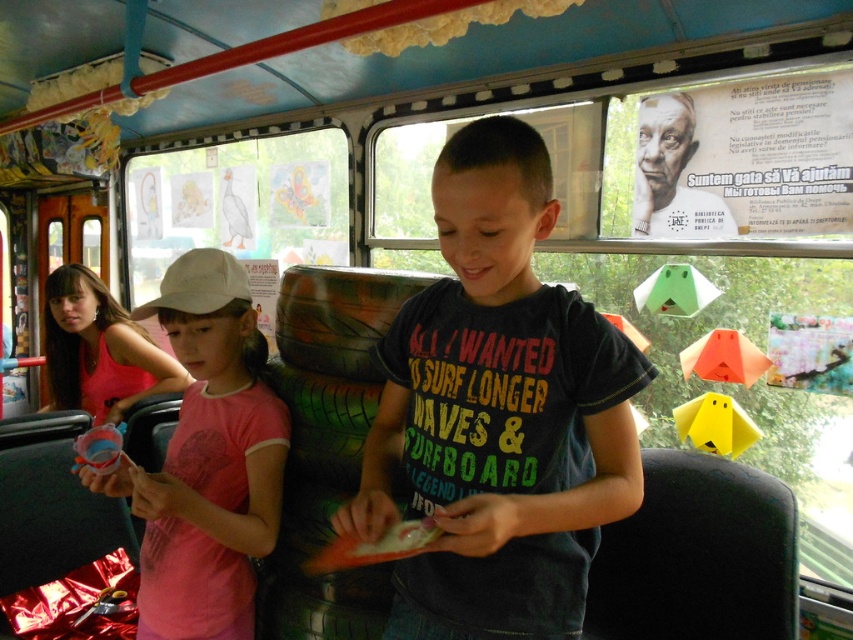
Does dark blue t-shirt at center appear on the right side of pink cotton shirt at left?

Yes, dark blue t-shirt at center is to the right of pink cotton shirt at left.

Who is taller, dark blue t-shirt at center or pink cotton shirt at left?

dark blue t-shirt at center

Is point (523, 259) positioned before point (227, 307)?

Yes, it is in front of point (227, 307).

Where is `dark blue t-shirt at center`? The height and width of the screenshot is (640, 853). dark blue t-shirt at center is located at coordinates (498, 412).